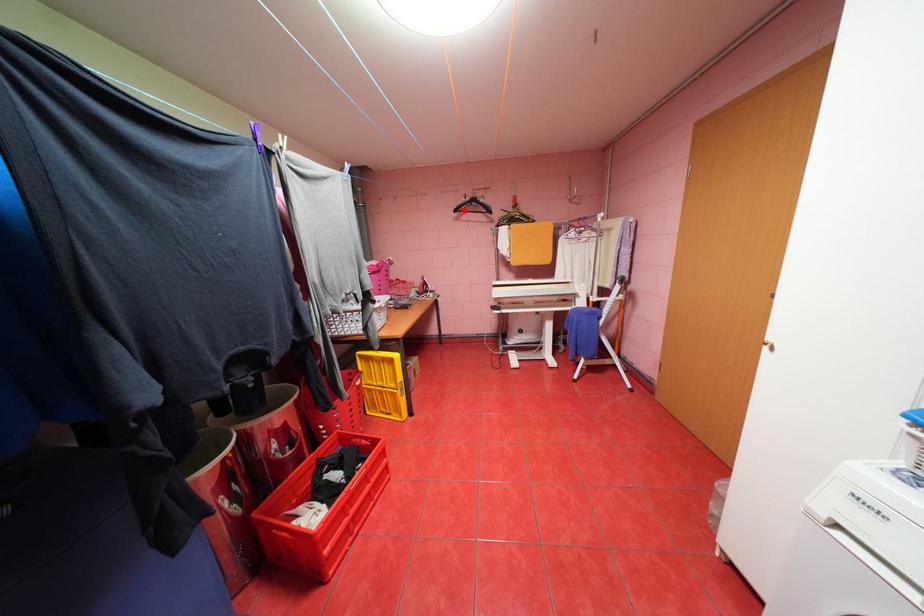
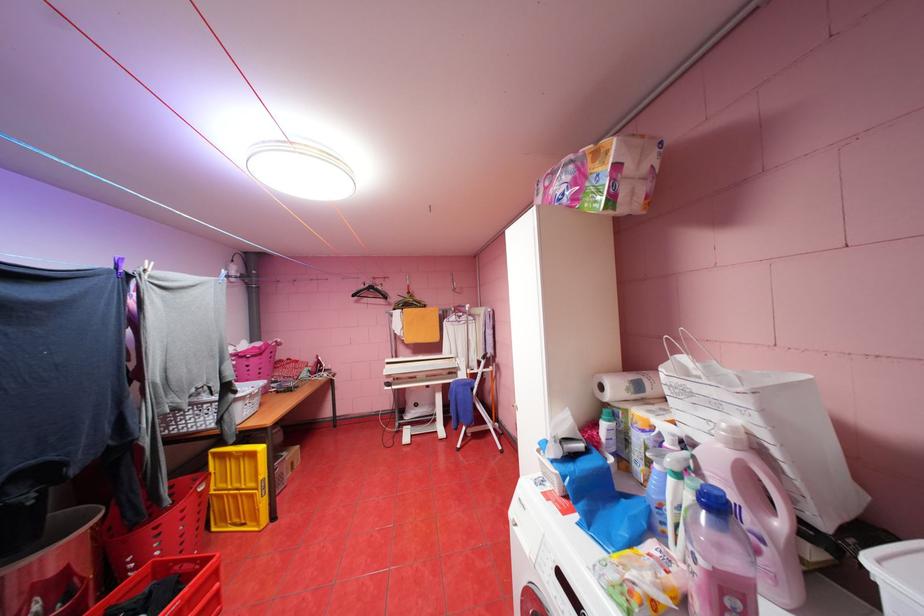
Locate, in the second image, the point that corresponds to the highlighted location in the first image.

(361, 294)